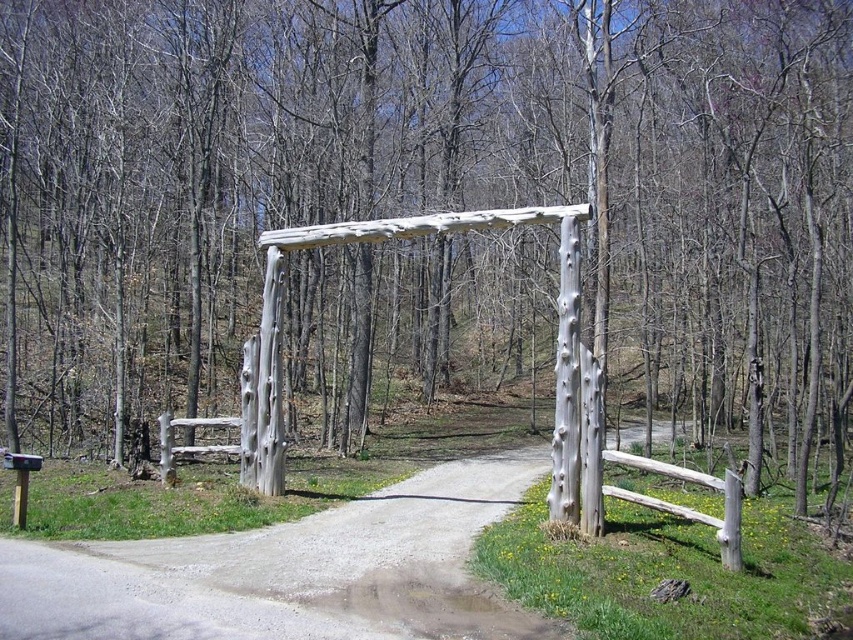
Is dirt/gravel path at center smaller than white driftwood gate at center?

Actually, dirt/gravel path at center might be larger than white driftwood gate at center.

Does point (349, 504) come farther from viewer compared to point (277, 449)?

Yes, it is behind point (277, 449).

Identify the location of dirt/gravel path at center. The width and height of the screenshot is (853, 640). (289, 572).